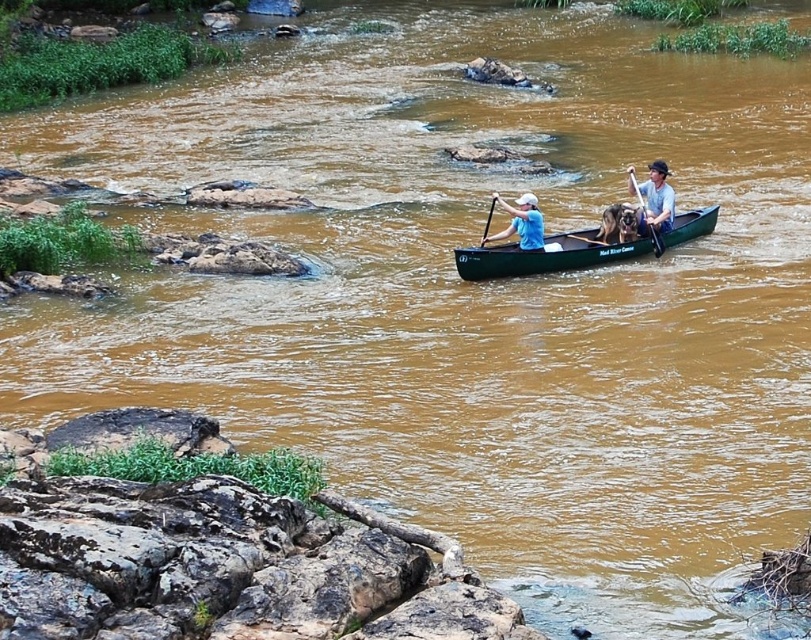
Is green plastic canoe at center positioned at the back of black plastic paddle at center?

No, green plastic canoe at center is in front of black plastic paddle at center.

What do you see at coordinates (546, 256) in the screenshot? This screenshot has height=640, width=811. I see `green plastic canoe at center` at bounding box center [546, 256].

Which is behind, point (698, 220) or point (488, 227)?

Point (698, 220)

Identify the location of green plastic canoe at center. (546, 256).

Between point (633, 172) and point (492, 196), which one is positioned in front?

Point (492, 196) is in front.

Between point (650, 230) and point (483, 234), which one is positioned in front?

Point (650, 230) is more forward.

You are a GUI agent. You are given a task and a screenshot of the screen. Output one action in this format:
    pyautogui.click(x=<x>, y=<y>)
    Task: Click on the wooden paddle at right
    This screenshot has width=811, height=640.
    Given the screenshot: What is the action you would take?
    pyautogui.click(x=655, y=241)

What do you see at coordinates (546, 256) in the screenshot? I see `green plastic canoe at center` at bounding box center [546, 256].

Does green plastic canoe at center have a smaller size compared to blue fabric shirt at center?

No, green plastic canoe at center is not smaller than blue fabric shirt at center.

Image resolution: width=811 pixels, height=640 pixels. Describe the element at coordinates (546, 256) in the screenshot. I see `green plastic canoe at center` at that location.

You are a GUI agent. You are given a task and a screenshot of the screen. Output one action in this format:
    pyautogui.click(x=<x>, y=<y>)
    Task: Click on the green plastic canoe at center
    The height and width of the screenshot is (640, 811).
    Given the screenshot: What is the action you would take?
    pyautogui.click(x=546, y=256)